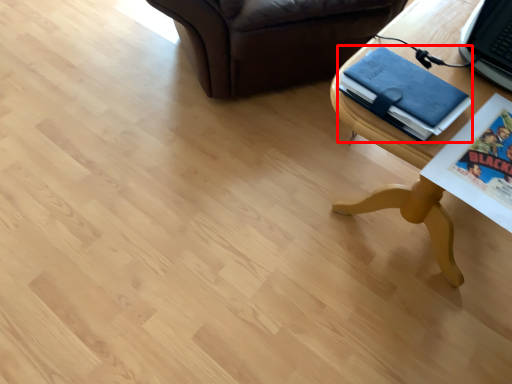
Question: From the image, what is the correct spatial relationship of binder (annotated by the red box) in relation to table?

Choices:
 (A) left
 (B) right

Answer: (A)